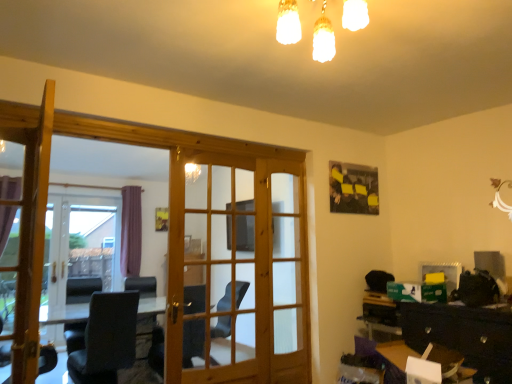
Question: From the image's perspective, would you say matte wooden screen door at center, which appears as the first screen door when viewed from the right, is shown under clear glass door at left, the second screen door positioned from the right?

Choices:
 (A) no
 (B) yes

Answer: (A)

Question: Considering the relative sizes of matte wooden screen door at center, acting as the 2th screen door starting from the left, and clear glass door at left, arranged as the 1th screen door when viewed from the left, in the image provided, is matte wooden screen door at center, acting as the 2th screen door starting from the left, smaller than clear glass door at left, arranged as the 1th screen door when viewed from the left,?

Choices:
 (A) yes
 (B) no

Answer: (A)

Question: Can you confirm if matte wooden screen door at center, which is the first screen door from front to back, is positioned to the right of clear glass door at left, the second screen door positioned from the right?

Choices:
 (A) yes
 (B) no

Answer: (A)

Question: Is matte wooden screen door at center, which appears as the first screen door when viewed from the right, positioned before clear glass door at left, arranged as the 1th screen door when viewed from the left?

Choices:
 (A) yes
 (B) no

Answer: (A)

Question: Is matte wooden screen door at center, acting as the 2th screen door starting from the left, further to camera compared to clear glass door at left, arranged as the 1th screen door when viewed from the left?

Choices:
 (A) no
 (B) yes

Answer: (A)

Question: Is point (428, 332) closer or farther from the camera than point (68, 261)?

Choices:
 (A) closer
 (B) farther

Answer: (A)

Question: Is black glossy dresser at lower right to the left or to the right of clear glass door at left, arranged as the 1th screen door when viewed from the left, in the image?

Choices:
 (A) right
 (B) left

Answer: (A)

Question: Considering the positions of black glossy dresser at lower right and clear glass door at left, the second screen door positioned from the right, in the image, is black glossy dresser at lower right taller or shorter than clear glass door at left, the second screen door positioned from the right,?

Choices:
 (A) short
 (B) tall

Answer: (A)

Question: Considering the positions of black glossy dresser at lower right and clear glass door at left, the first screen door when ordered from back to front, in the image, is black glossy dresser at lower right bigger or smaller than clear glass door at left, the first screen door when ordered from back to front,?

Choices:
 (A) small
 (B) big

Answer: (A)

Question: Considering the positions of point (109, 206) and point (227, 243), is point (109, 206) closer or farther from the camera than point (227, 243)?

Choices:
 (A) closer
 (B) farther

Answer: (B)

Question: Considering their positions, is clear glass door at left, the 2th screen door from the front, located in front of or behind wooden door at center, which is counted as the 1th door, starting from the back?

Choices:
 (A) front
 (B) behind

Answer: (B)

Question: From the image's perspective, is clear glass door at left, the first screen door when ordered from back to front, located above or below wooden door at center, placed as the 2th door when sorted from left to right?

Choices:
 (A) above
 (B) below

Answer: (B)

Question: Is clear glass door at left, the first screen door when ordered from back to front, bigger or smaller than wooden door at center, which is counted as the 1th door, starting from the back?

Choices:
 (A) big
 (B) small

Answer: (A)

Question: From the image's perspective, is wooden door at center, which is counted as the 1th door, starting from the back, located above or below matte wooden screen door at center, acting as the 2th screen door starting from the left?

Choices:
 (A) above
 (B) below

Answer: (A)

Question: From their relative heights in the image, would you say wooden door at center, the second door viewed from the front, is taller or shorter than matte wooden screen door at center, which appears as the first screen door when viewed from the right?

Choices:
 (A) tall
 (B) short

Answer: (B)